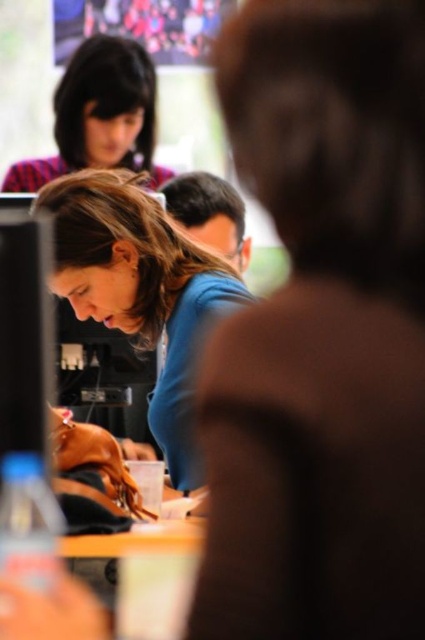
Question: Which of the following is the farthest from the observer?

Choices:
 (A) (175, 385)
 (B) (56, 141)

Answer: (B)

Question: Does blue matte shirt at center appear on the right side of plaid fabric headscarf at upper left?

Choices:
 (A) yes
 (B) no

Answer: (A)

Question: Does blue matte shirt at center appear under plaid fabric headscarf at upper left?

Choices:
 (A) yes
 (B) no

Answer: (A)

Question: Is blue matte shirt at center bigger than plaid fabric headscarf at upper left?

Choices:
 (A) yes
 (B) no

Answer: (B)

Question: Among these points, which one is nearest to the camera?

Choices:
 (A) click(122, 93)
 (B) click(88, 308)

Answer: (B)